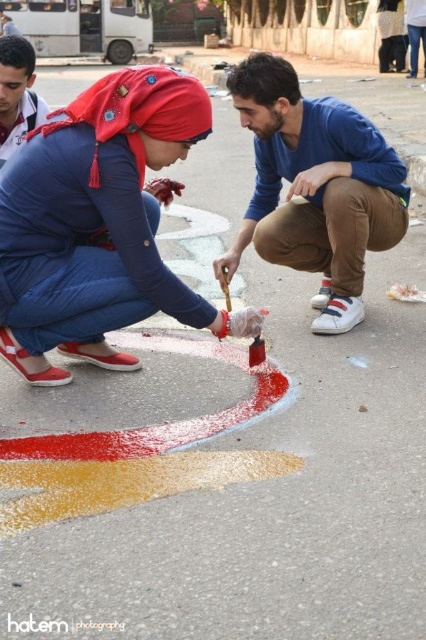
Question: Where is blue cotton shirt at center located in relation to wooden handle paint brush at center in the image?

Choices:
 (A) right
 (B) left

Answer: (A)

Question: Considering the relative positions of matte red paintbrush at center and wooden handle paint brush at center in the image provided, where is matte red paintbrush at center located with respect to wooden handle paint brush at center?

Choices:
 (A) right
 (B) left

Answer: (B)

Question: Among these points, which one is farthest from the camera?

Choices:
 (A) (11, 317)
 (B) (2, 108)

Answer: (B)

Question: Which point is closer to the camera?

Choices:
 (A) (109, 269)
 (B) (314, 122)

Answer: (A)

Question: Which of the following is the closest to the observer?

Choices:
 (A) [222, 288]
 (B) [316, 268]

Answer: (A)

Question: Can you confirm if matte red paintbrush at center is positioned to the left of wooden handle paint brush at center?

Choices:
 (A) no
 (B) yes

Answer: (B)